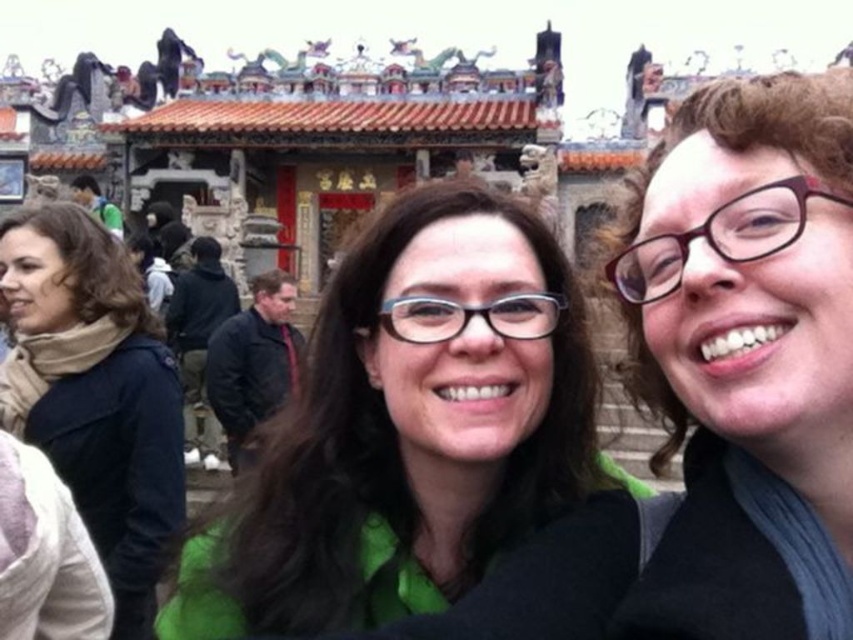
You are a photographer trying to capture a clear shot of the green matte shirt at center and the matte black glasses at upper right. Which object should you focus on first if you want to ensure both are in focus, considering their positions relative to the camera?

The green matte shirt at center is not as tall as the matte black glasses at upper right, so you should focus on the matte black glasses at upper right first to ensure both are in focus.

You are a photographer standing at the scene. You want to take a photo of the matte black glasses at upper right. Considering the distance, will you need a telephoto lens to capture the glasses clearly?

The matte black glasses at upper right are 50.22 meters away from the camera. Since telephoto lenses are designed for distant subjects, you will need a telephoto lens to capture the glasses clearly.

You are taking a photo of the scene and want to ensure both the matte black glasses at upper right and the beige scarf at left are in focus. Based on their positions, which object is closer to the camera?

The beige scarf at left is closer to the camera because the matte black glasses at upper right are positioned to the right of it, indicating they are further away.